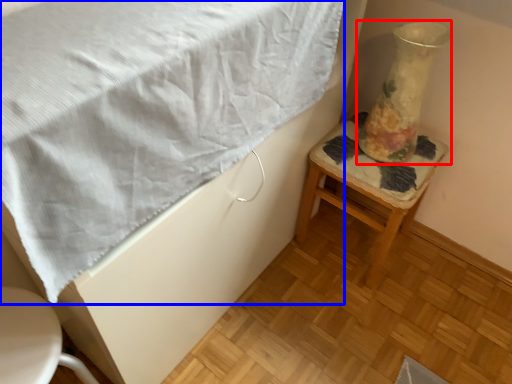
Question: Which object appears farthest to the camera in this image, vase (highlighted by a red box) or blanket (highlighted by a blue box)?

Choices:
 (A) vase
 (B) blanket

Answer: (A)